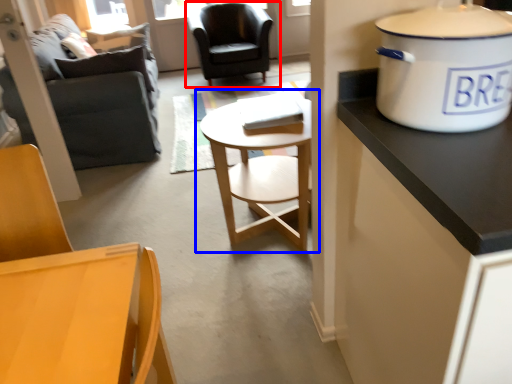
Question: Which of the following is the closest to the observer, chair (highlighted by a red box) or coffee table (highlighted by a blue box)?

Choices:
 (A) chair
 (B) coffee table

Answer: (B)